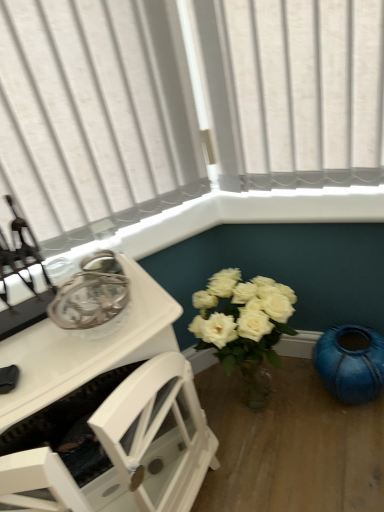
Question: Could white glossy table at upper left be considered to be inside teal glossy vase at lower right?

Choices:
 (A) yes
 (B) no

Answer: (B)

Question: From the image's perspective, would you say teal glossy vase at lower right is shown under white glossy table at upper left?

Choices:
 (A) yes
 (B) no

Answer: (A)

Question: From a real-world perspective, is teal glossy vase at lower right below white glossy table at upper left?

Choices:
 (A) no
 (B) yes

Answer: (B)

Question: Can you confirm if teal glossy vase at lower right is positioned to the right of white glossy table at upper left?

Choices:
 (A) no
 (B) yes

Answer: (B)

Question: Is teal glossy vase at lower right in front of white glossy table at upper left?

Choices:
 (A) yes
 (B) no

Answer: (B)

Question: From a real-world perspective, does teal glossy vase at lower right stand above white glossy table at upper left?

Choices:
 (A) yes
 (B) no

Answer: (B)

Question: Does white glossy table at upper left have a greater width compared to teal glossy vase at lower right?

Choices:
 (A) no
 (B) yes

Answer: (B)

Question: Is there a large distance between white glossy table at upper left and teal glossy vase at lower right?

Choices:
 (A) no
 (B) yes

Answer: (A)

Question: From the image's perspective, does white glossy table at upper left appear lower than teal glossy vase at lower right?

Choices:
 (A) yes
 (B) no

Answer: (B)

Question: Does white glossy table at upper left lie in front of teal glossy vase at lower right?

Choices:
 (A) no
 (B) yes

Answer: (B)

Question: Is white glossy table at upper left oriented away from teal glossy vase at lower right?

Choices:
 (A) yes
 (B) no

Answer: (B)

Question: Is white glossy table at upper left smaller than teal glossy vase at lower right?

Choices:
 (A) no
 (B) yes

Answer: (B)

Question: From the image's perspective, relative to white glossy table at upper left, is teal glossy vase at lower right above or below?

Choices:
 (A) below
 (B) above

Answer: (A)